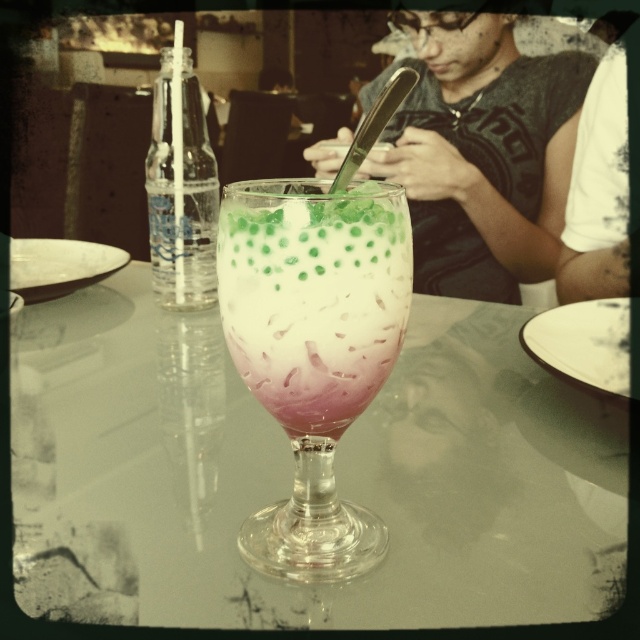
Does transparent glass table at center have a greater width compared to pink frosted glass at center?

Indeed, transparent glass table at center has a greater width compared to pink frosted glass at center.

Is transparent glass table at center closer to camera compared to pink frosted glass at center?

That is False.

Who is more forward, (552, 529) or (252, 241)?

Point (252, 241)

Locate an element on the screen. The image size is (640, 640). transparent glass table at center is located at coordinates (291, 474).

Does pink frosted glass at center appear under clear plastic bottle at left?

Yes, pink frosted glass at center is below clear plastic bottle at left.

Who is positioned more to the left, pink frosted glass at center or clear plastic bottle at left?

clear plastic bottle at left is more to the left.

Locate an element on the screen. Image resolution: width=640 pixels, height=640 pixels. pink frosted glass at center is located at coordinates (314, 348).

Where is `pink frosted glass at center`? pink frosted glass at center is located at coordinates (314, 348).

Can you confirm if pink frosted glass at center is thinner than dark gray shirt at center?

Correct, pink frosted glass at center's width is less than dark gray shirt at center's.

Is point (312, 364) positioned behind point (436, 204)?

No, (312, 364) is in front of (436, 204).

Who is more forward, (262, 321) or (524, 186)?

Point (262, 321) is in front.

Locate an element on the screen. pink frosted glass at center is located at coordinates (314, 348).